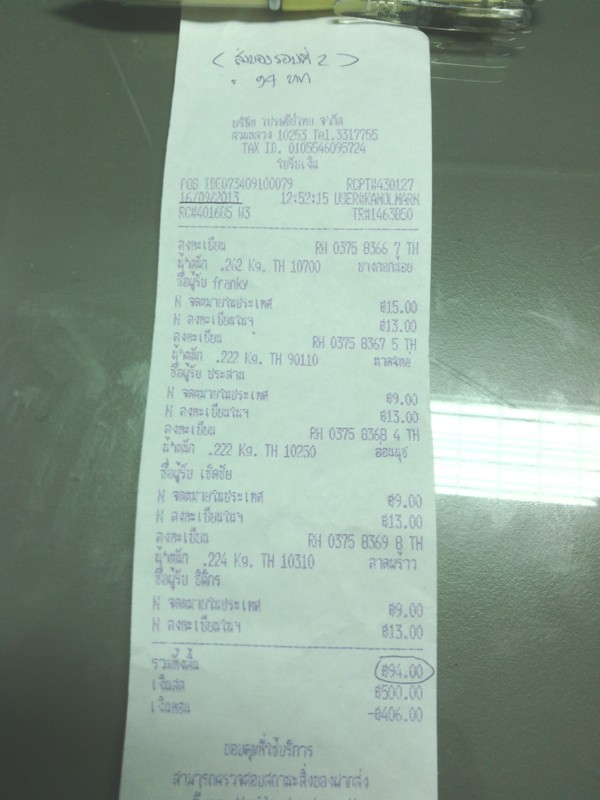
This screenshot has width=600, height=800. What are the coordinates of `pen` in the screenshot? It's located at (421, 14).